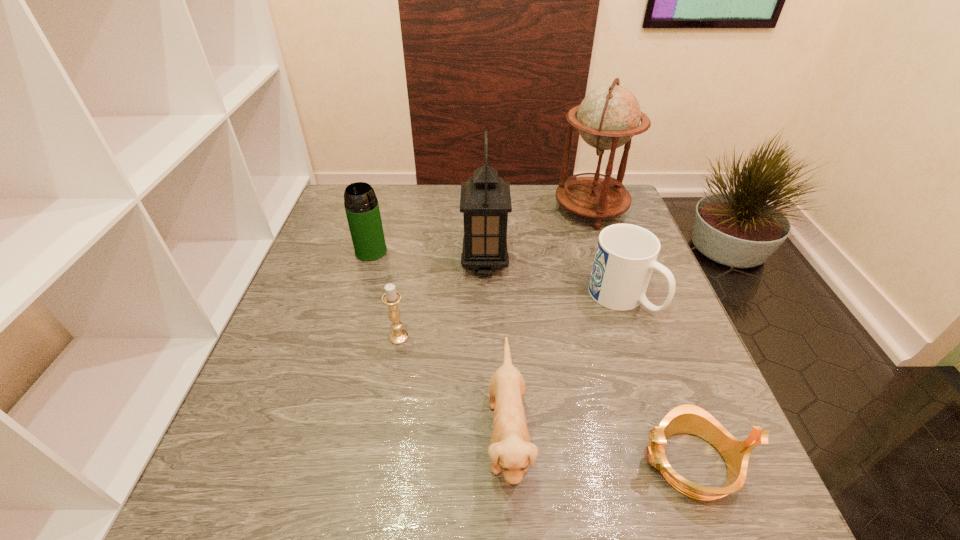
Locate an element on the screen. free point located on the surface of the globe is located at coordinates (439, 210).

Find the location of a particular element. The width and height of the screenshot is (960, 540). free space located 0.350m on the surface of the globe is located at coordinates (439, 210).

Where is `free spot located 0.230m on the back of the lantern`? Image resolution: width=960 pixels, height=540 pixels. free spot located 0.230m on the back of the lantern is located at coordinates coord(484,203).

Locate an element on the screen. vacant space situated from the spout of the fifth shortest object is located at coordinates (334, 376).

Find the location of a particular element. free point located on the front of the mug is located at coordinates (684, 481).

Where is `vacant area situated on the left of the candle holder`? Image resolution: width=960 pixels, height=540 pixels. vacant area situated on the left of the candle holder is located at coordinates (302, 337).

This screenshot has width=960, height=540. In order to click on free space located 0.210m on the left side of the puppy in this screenshot , I will do `click(370, 436)`.

The height and width of the screenshot is (540, 960). Find the location of `free space located on the left side of the puppy`. free space located on the left side of the puppy is located at coordinates (387, 436).

Find the location of `blank space located 0.200m on the left side of the puppy`. blank space located 0.200m on the left side of the puppy is located at coordinates (375, 436).

The height and width of the screenshot is (540, 960). I want to click on vacant position located 0.380m at the front emblem of the shortest object, so click(415, 462).